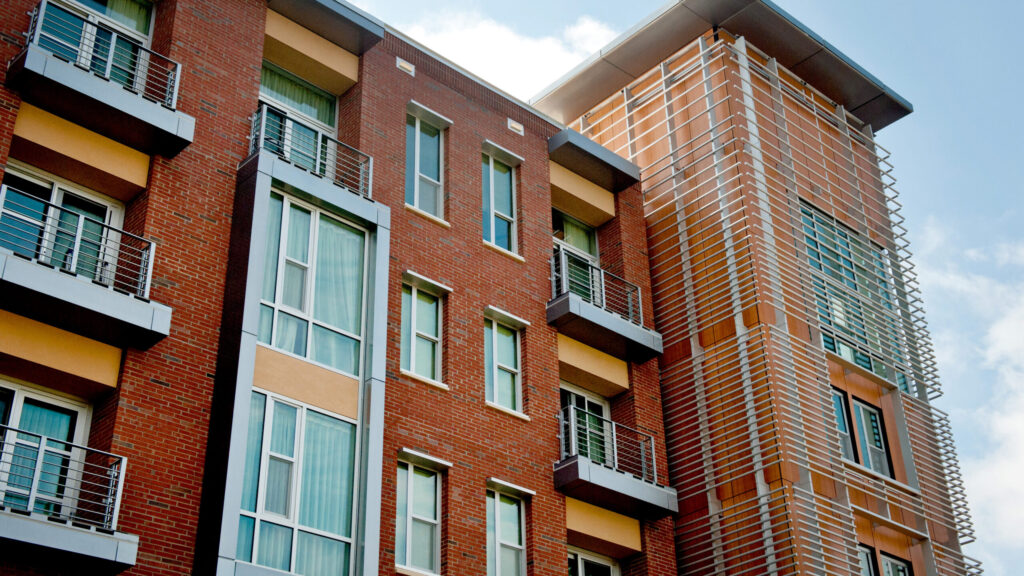
Where is `door`? The height and width of the screenshot is (576, 1024). door is located at coordinates (86, 222), (119, 65), (68, 430), (307, 143), (579, 283), (595, 445).